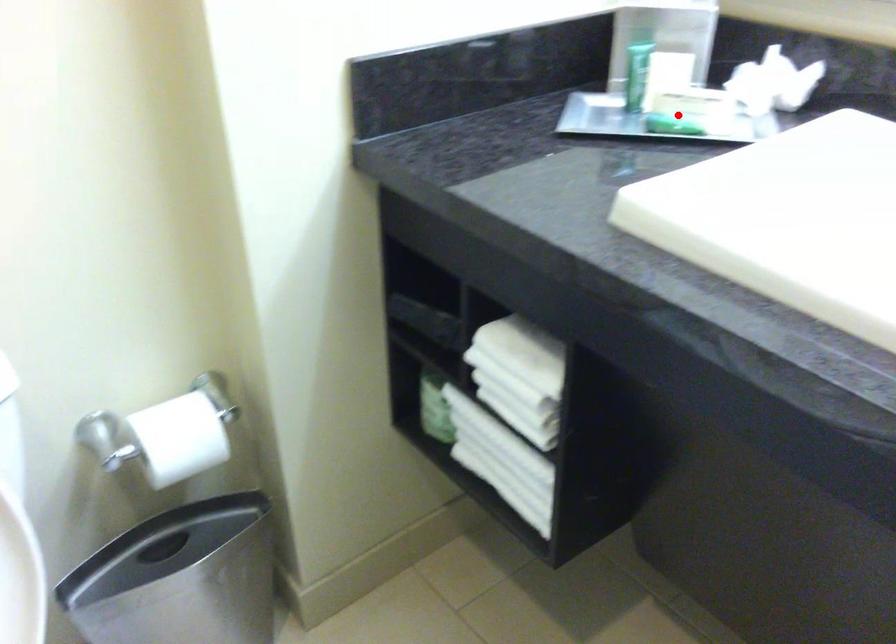
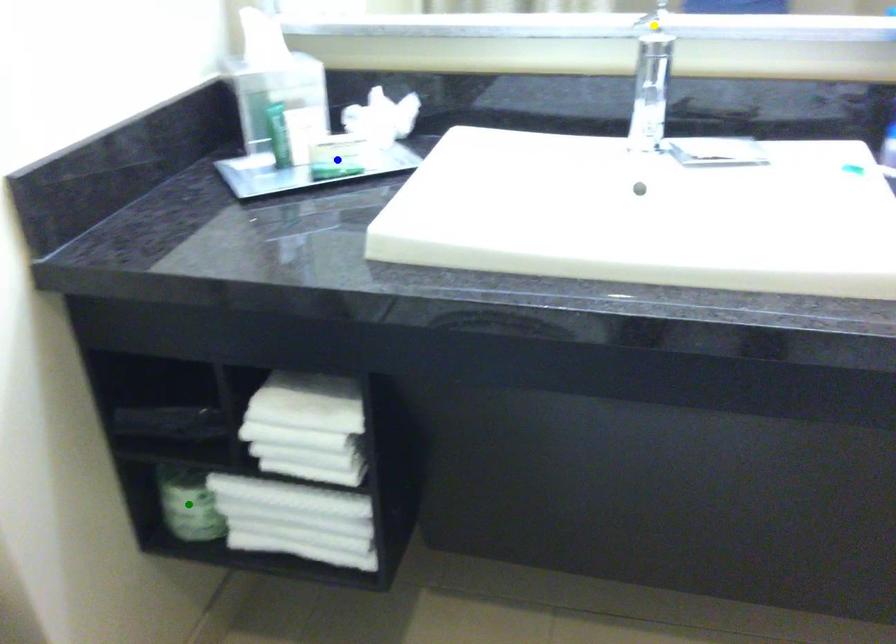
Question: I am providing you with two images of the same scene from different viewpoints. A red point is marked on the first image. You are given multiple points on the second image. Which mark in image 2 goes with the point in image 1?

Choices:
 (A) blue point
 (B) yellow point
 (C) green point

Answer: (A)